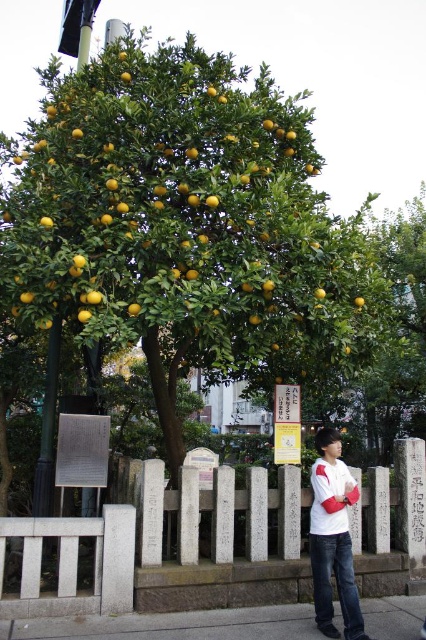
You are standing at the base of the orange tree and want to walk towards the white stone fence at center. Which direction should you move to reach it?

The white stone fence at center is located at point (x=161, y=548), so you should move towards the center of the image to reach it.